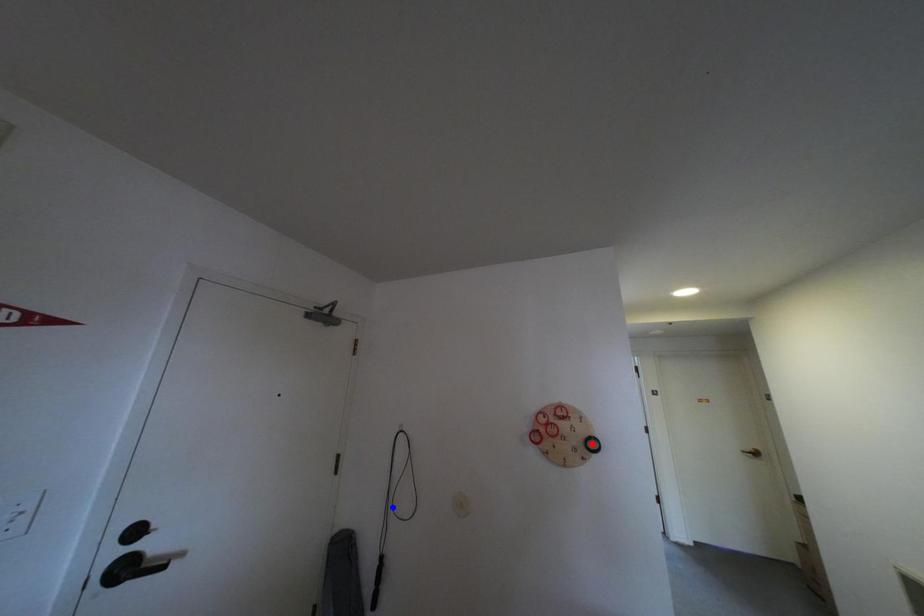
Question: Two points are marked on the image. Which point is closer to the camera?

Choices:
 (A) Blue point is closer.
 (B) Red point is closer.

Answer: (B)